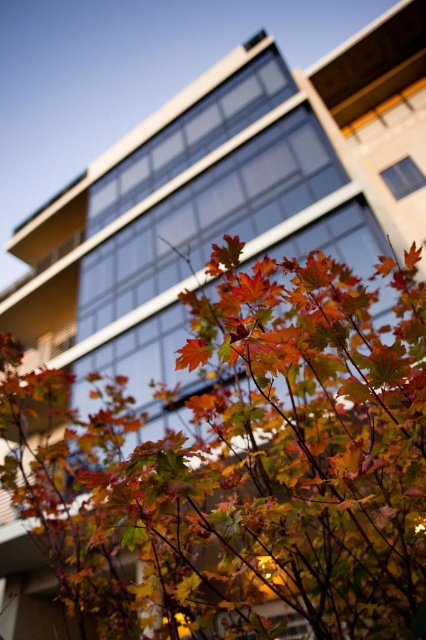
Question: Is autumn leaves at center above orange matte maple leaf at center?

Choices:
 (A) yes
 (B) no

Answer: (B)

Question: Which point is farther to the camera?

Choices:
 (A) (178, 369)
 (B) (49, 554)

Answer: (B)

Question: Is autumn leaves at center closer to camera compared to orange matte maple leaf at center?

Choices:
 (A) yes
 (B) no

Answer: (B)

Question: Which point appears closest to the camera in this image?

Choices:
 (A) (196, 362)
 (B) (120, 556)

Answer: (A)

Question: Does autumn leaves at center have a lesser width compared to orange matte maple leaf at center?

Choices:
 (A) no
 (B) yes

Answer: (A)